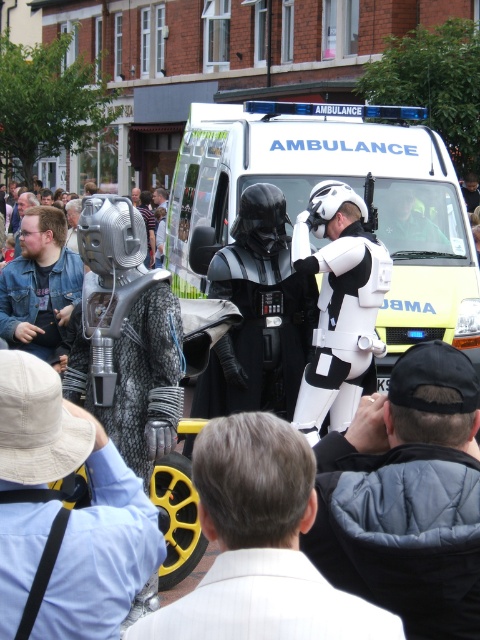
You are standing at the position of the Cyberman figure on the left. You want to move towards the ambulance in the background. Which direction should you move to first reach the point closer to the camera between point (x=219, y=401) and point (x=403, y=228)?

Point (x=219, y=401) is closer to the camera than point (x=403, y=228). Therefore, to reach the closer point first, you should move towards the direction of point (x=219, y=401).

You are a photographer trying to capture both the black matte helmet at center and the green reflective helmet at center in a single shot. Based on their positions, which helmet should you focus on first to ensure both are in frame?

The black matte helmet at center is to the left of green reflective helmet at center, so focusing on the black matte helmet at center first will allow you to adjust the frame to include both helmets since they are positioned side by side.

You are a photographer standing at the center of the street. You want to take a photo of the white textured suit at center and the ambulance in the background. Can you fit both in the frame without moving your position?

The white textured suit at center and the ambulance in the background are 1.90 meters apart. Since the photographer is at the center, the distance between them is manageable to fit both in the frame without moving.